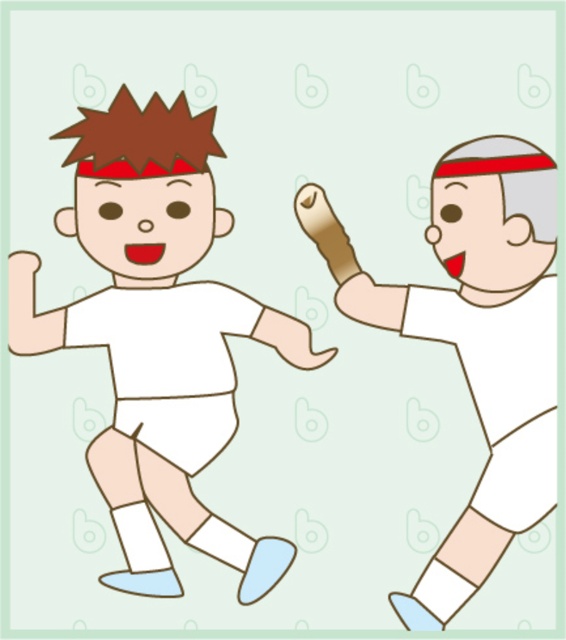
Question: Does white matte/soft boy at left appear over white matte/soft boy at right?

Choices:
 (A) no
 (B) yes

Answer: (B)

Question: Among these objects, which one is nearest to the camera?

Choices:
 (A) white matte/soft boy at right
 (B) white matte/soft boy at left

Answer: (A)

Question: Can you confirm if white matte/soft boy at left is wider than white matte/soft boy at right?

Choices:
 (A) no
 (B) yes

Answer: (B)

Question: Which of the following is the closest to the observer?

Choices:
 (A) white matte/soft boy at left
 (B) white matte/soft boy at right

Answer: (B)

Question: Can you confirm if white matte/soft boy at left is positioned to the right of white matte/soft boy at right?

Choices:
 (A) yes
 (B) no

Answer: (B)